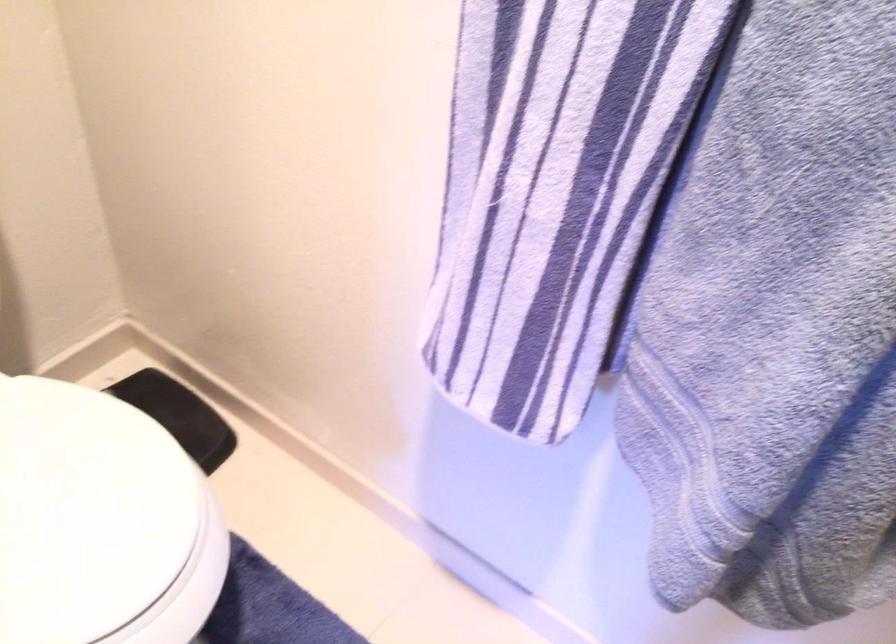
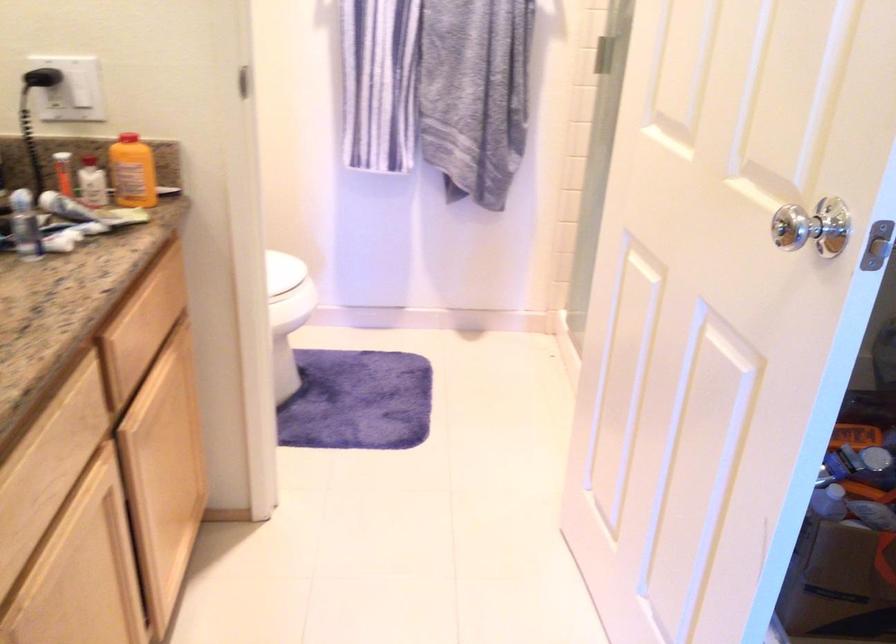
The point at (100, 574) is marked in the first image. Where is the corresponding point in the second image?

(282, 270)